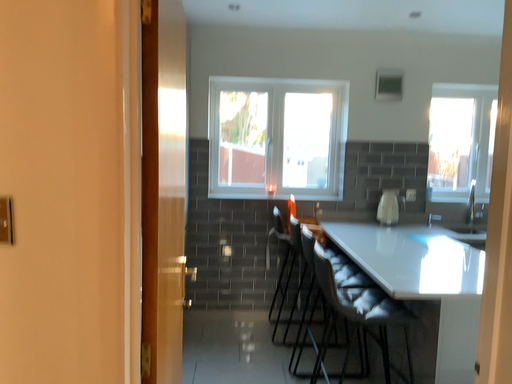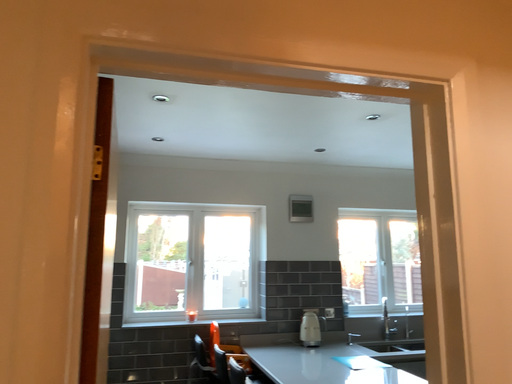
Question: Which way did the camera rotate in the video?

Choices:
 (A) rotated left
 (B) rotated right

Answer: (B)